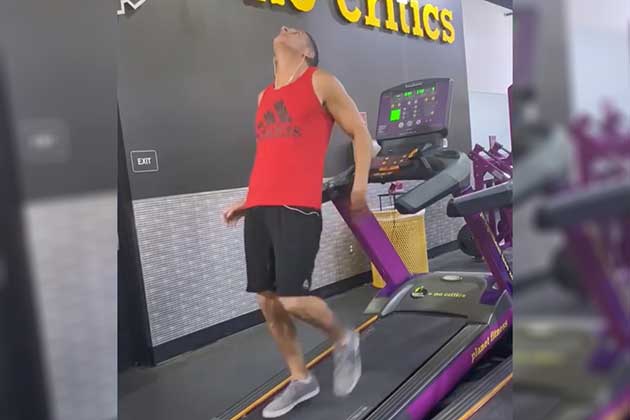
Image resolution: width=630 pixels, height=420 pixels. Identify the location of doorway. (130, 263).